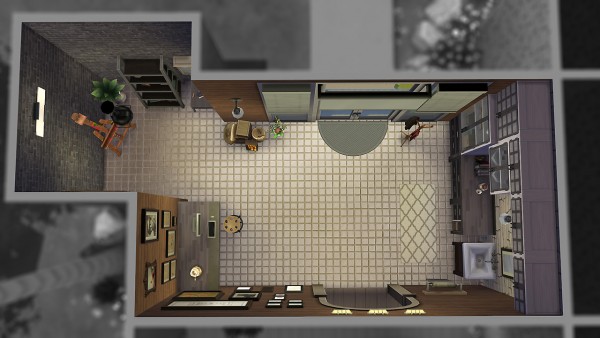
Where is `seat`? seat is located at coordinates (232, 227).